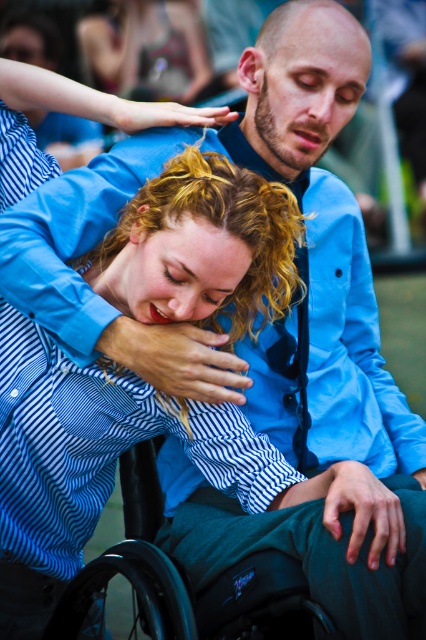
You are a photographer who wants to adjust the lighting to highlight the curly blonde hair at center in the image. Based on its position, which coordinates should you focus your spotlight on?

The curly blonde hair at center is located at coordinates point (203, 246), so you should focus the spotlight on those coordinates to highlight it.

You are a photographer adjusting the lighting for a portrait. You need to ensure that both the curly blonde hair at center and the black plastic wheelchair at lower center are well lit. Given their distance apart, do you think you can light them evenly without moving either object?

The curly blonde hair at center and the black plastic wheelchair at lower center are 5.25 feet apart. Since they are within a reasonable distance, you can use a softbox or diffuser to evenly light both objects without needing to move them.

You are a photographer adjusting your camera settings to capture a closeup of both the curly blonde hair at center and the matte blue shirt at upper left. Since the camera can only focus on one subject clearly, which object should you prioritize to ensure it appears taller in the photo?

The curly blonde hair at center should be prioritized as it is taller than the matte blue shirt at upper left, ensuring it appears more prominent in the closeup.